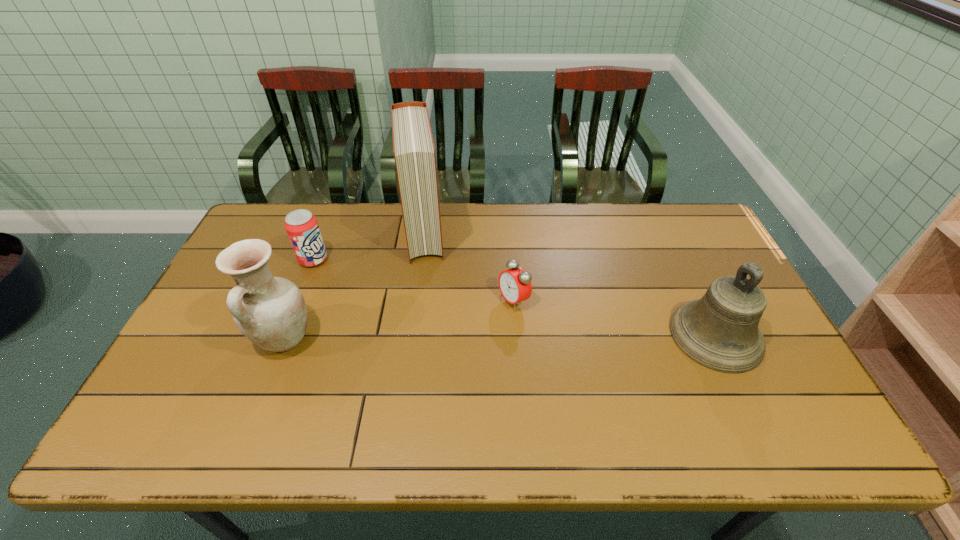
At what (x,y) coordinates should I click in order to perform the action: click on vacant space at the far edge. Please return your answer as a coordinate pair (x, y). Image resolution: width=960 pixels, height=540 pixels. Looking at the image, I should click on (482, 205).

Image resolution: width=960 pixels, height=540 pixels. Identify the location of vacant space at the near edge of the desktop. (693, 379).

Find the location of a particular element. This screenshot has width=960, height=540. blank area at the right edge is located at coordinates pos(711,256).

The width and height of the screenshot is (960, 540). In the image, there is a desktop. Identify the location of free space at the far right corner. (665, 207).

Where is `free space that is in between the pottery and the bell`? This screenshot has width=960, height=540. free space that is in between the pottery and the bell is located at coordinates (500, 338).

Locate an element on the screen. This screenshot has height=540, width=960. free space between the pottery and the bell is located at coordinates (500, 338).

This screenshot has width=960, height=540. I want to click on vacant space in between the hardback book and the pottery, so click(x=353, y=287).

Where is `free space between the rightmost object and the hardback book`? free space between the rightmost object and the hardback book is located at coordinates (569, 285).

Locate an element on the screen. The height and width of the screenshot is (540, 960). free space between the alarm clock and the bell is located at coordinates (614, 318).

Where is `empty space that is in between the pottery and the fourth object from left to right`? This screenshot has height=540, width=960. empty space that is in between the pottery and the fourth object from left to right is located at coordinates (398, 320).